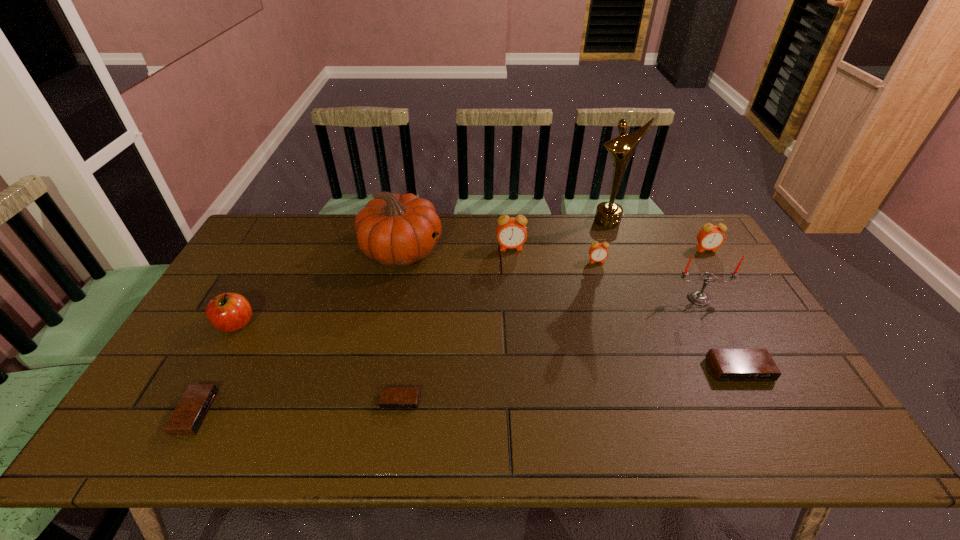
Locate an element on the screen. This screenshot has height=540, width=960. vacant region between the fifth alarm clock from right to left and the award is located at coordinates (504, 311).

Locate an element on the screen. The width and height of the screenshot is (960, 540). vacant space in between the orange pumpkin and the shortest object is located at coordinates (401, 326).

What are the coordinates of `empty location between the fourth nearest object and the red candle` in the screenshot? It's located at (468, 311).

You are a GUI agent. You are given a task and a screenshot of the screen. Output one action in this format:
    pyautogui.click(x=<x>, y=<y>)
    Task: Click on the unoccupied area between the sixth farthest object and the fifth tallest alarm clock
    
    Given the screenshot: What is the action you would take?
    pyautogui.click(x=447, y=355)

Locate an element on the screen. The width and height of the screenshot is (960, 540). free area in between the seventh farthest object and the orange pumpkin is located at coordinates coord(319,287).

The width and height of the screenshot is (960, 540). Identify the location of free spot between the apple and the orange pumpkin. (319, 287).

The height and width of the screenshot is (540, 960). Identify the location of free space between the apple and the shortest object. (318, 362).

Identify the location of vacant space that is in between the fourth alarm clock from right to left and the orange pumpkin. This screenshot has width=960, height=540. (456, 249).

Find the location of a particular element. blank region between the apple and the tallest object is located at coordinates (421, 273).

What are the coordinates of `object that is the seventh closest to the apple` in the screenshot? It's located at (698, 297).